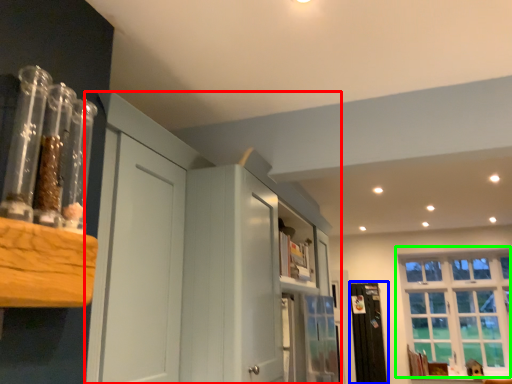
Question: Estimate the real-world distances between objects in this image. Which object is closer to dresser (highlighted by a red box), screen door (highlighted by a blue box) or window (highlighted by a green box)?

Choices:
 (A) screen door
 (B) window

Answer: (A)